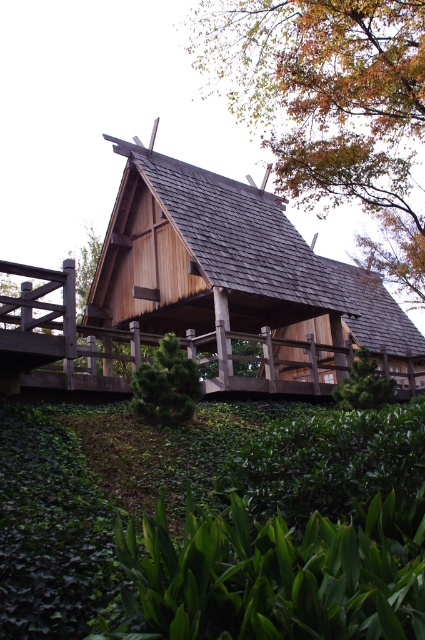
Who is lower down, wooden cabin at center or brown wooden roof at upper center?

Positioned lower is wooden cabin at center.

Does point (155, 164) come farther from viewer compared to point (294, 168)?

Yes.

Find the location of a particular element. wooden cabin at center is located at coordinates (x=238, y=282).